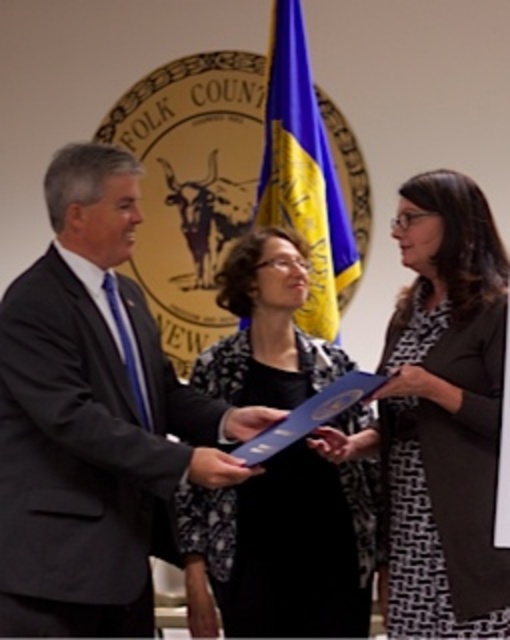
Question: Which of the following is the closest to the observer?

Choices:
 (A) (325, 444)
 (B) (43, 548)

Answer: (B)

Question: Which object appears closest to the camera in this image?

Choices:
 (A) blue paper at center
 (B) dark gray suit at center
 (C) black textured scarf at center
 (D) blue/yellow fabric flag at center

Answer: (B)

Question: Can you confirm if black textured scarf at center is positioned to the left of blue/yellow fabric flag at center?

Choices:
 (A) yes
 (B) no

Answer: (A)

Question: Does black textured dress at center appear over black textured scarf at center?

Choices:
 (A) yes
 (B) no

Answer: (A)

Question: Which of the following is the farthest from the observer?

Choices:
 (A) [x=236, y=432]
 (B) [x=190, y=476]

Answer: (A)

Question: Is dark gray suit at center smaller than blue paper at center?

Choices:
 (A) yes
 (B) no

Answer: (B)